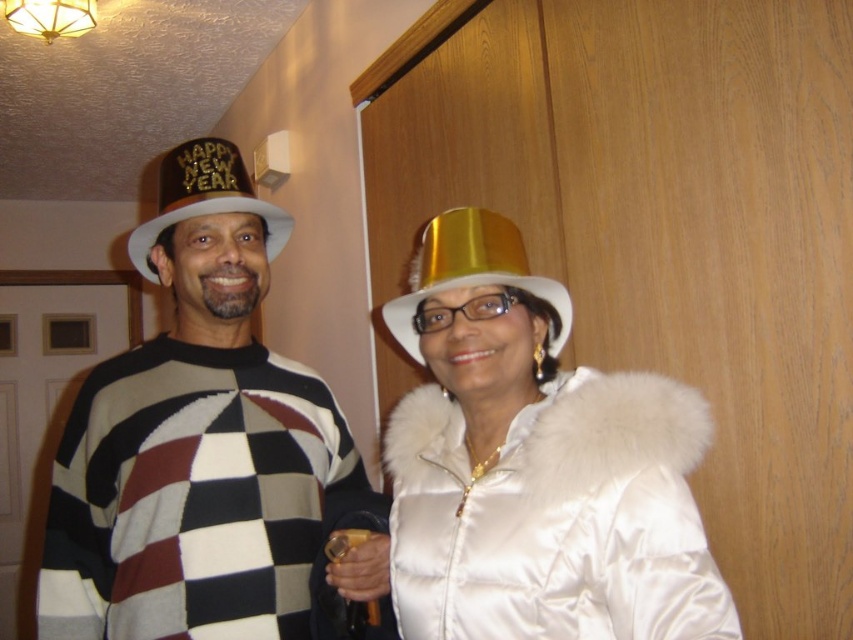
Is point (527, 333) behind point (238, 173)?

No, it is not.

Who is more distant from viewer, (x=418, y=577) or (x=289, y=227)?

Positioned behind is point (x=289, y=227).

Image resolution: width=853 pixels, height=640 pixels. Identify the location of satin gold top hat at center. (535, 465).

Does gold shiny hat at center have a larger size compared to gold shiny paper hat at left?

No, gold shiny hat at center is not bigger than gold shiny paper hat at left.

Who is positioned more to the left, gold shiny hat at center or gold shiny paper hat at left?

gold shiny paper hat at left is more to the left.

Is point (524, 282) farther from viewer compared to point (161, 161)?

No, (524, 282) is in front of (161, 161).

Image resolution: width=853 pixels, height=640 pixels. In order to click on gold shiny hat at center in this screenshot , I will do `click(471, 269)`.

Is checkerboard sweater at left wider than gold shiny paper hat at left?

Yes, checkerboard sweater at left is wider than gold shiny paper hat at left.

Consider the image. Does checkerboard sweater at left have a lesser height compared to gold shiny paper hat at left?

No, checkerboard sweater at left is not shorter than gold shiny paper hat at left.

Locate an element on the screen. checkerboard sweater at left is located at coordinates (195, 442).